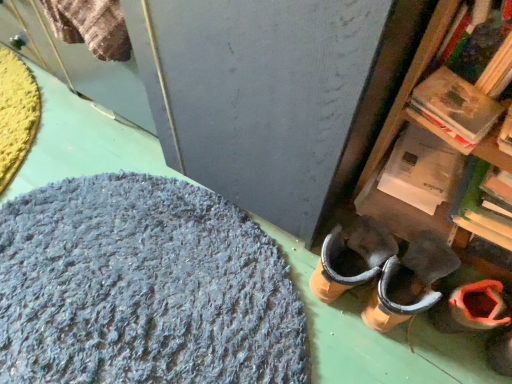
Question: Is shaggy gray rug at lower left aimed at orange suede boot at lower right?

Choices:
 (A) yes
 (B) no

Answer: (B)

Question: Does shaggy gray rug at lower left lie in front of orange suede boot at lower right?

Choices:
 (A) yes
 (B) no

Answer: (A)

Question: Is shaggy gray rug at lower left shorter than orange suede boot at lower right?

Choices:
 (A) yes
 (B) no

Answer: (A)

Question: From the image's perspective, would you say shaggy gray rug at lower left is positioned over orange suede boot at lower right?

Choices:
 (A) no
 (B) yes

Answer: (B)

Question: Is shaggy gray rug at lower left surrounding orange suede boot at lower right?

Choices:
 (A) yes
 (B) no

Answer: (B)

Question: Is shaggy gray rug at lower left facing away from orange suede boot at lower right?

Choices:
 (A) no
 (B) yes

Answer: (A)

Question: From a real-world perspective, is orange suede boot at lower right over shaggy gray rug at lower left?

Choices:
 (A) no
 (B) yes

Answer: (B)

Question: Can you confirm if orange suede boot at lower right is bigger than shaggy gray rug at lower left?

Choices:
 (A) no
 (B) yes

Answer: (A)

Question: Is orange suede boot at lower right further to camera compared to shaggy gray rug at lower left?

Choices:
 (A) yes
 (B) no

Answer: (A)

Question: Considering the relative sizes of orange suede boot at lower right and shaggy gray rug at lower left in the image provided, is orange suede boot at lower right smaller than shaggy gray rug at lower left?

Choices:
 (A) yes
 (B) no

Answer: (A)

Question: Does orange suede boot at lower right have a greater width compared to shaggy gray rug at lower left?

Choices:
 (A) yes
 (B) no

Answer: (B)

Question: From a real-world perspective, is orange suede boot at lower right under shaggy gray rug at lower left?

Choices:
 (A) yes
 (B) no

Answer: (B)

Question: From the image's perspective, relative to orange suede boot at lower right, is shaggy gray rug at lower left above or below?

Choices:
 (A) below
 (B) above

Answer: (B)